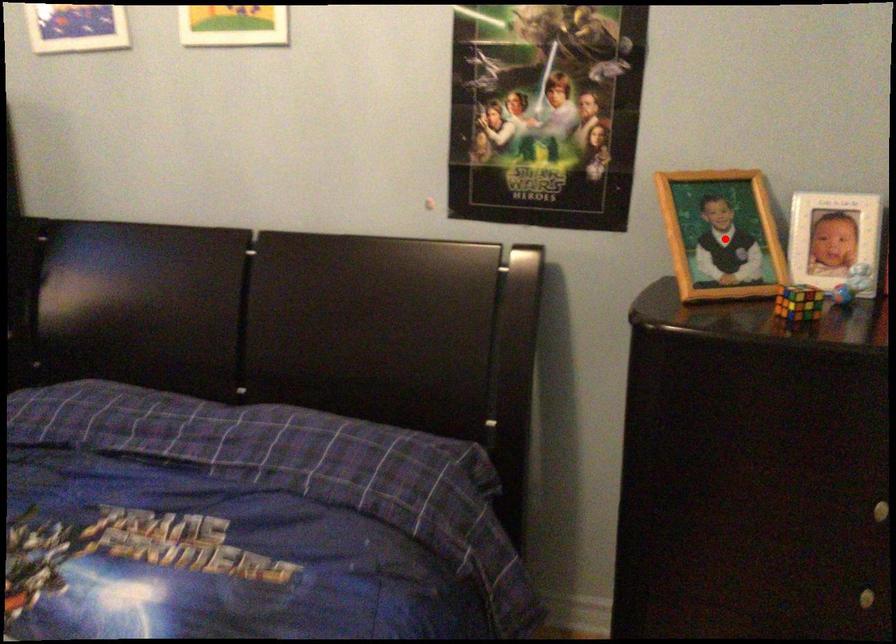
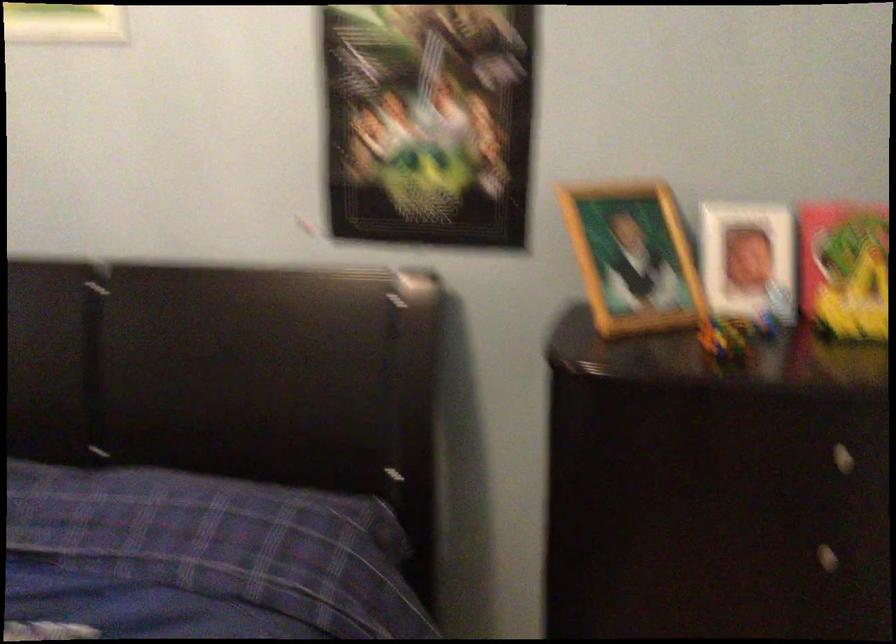
Locate, in the second image, the point that corresponds to the highlighted location in the first image.

(633, 258)